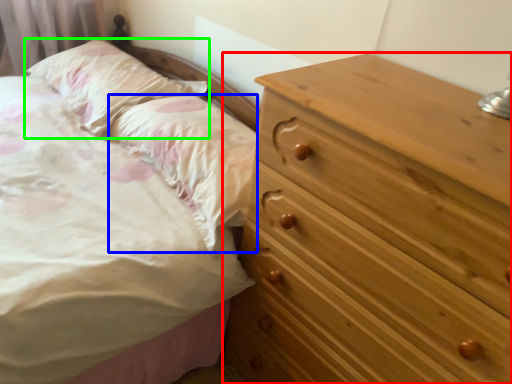
Question: Which is nearer to the chest of drawers (highlighted by a red box)? pillow (highlighted by a blue box) or pillow (highlighted by a green box).

Choices:
 (A) pillow
 (B) pillow

Answer: (A)